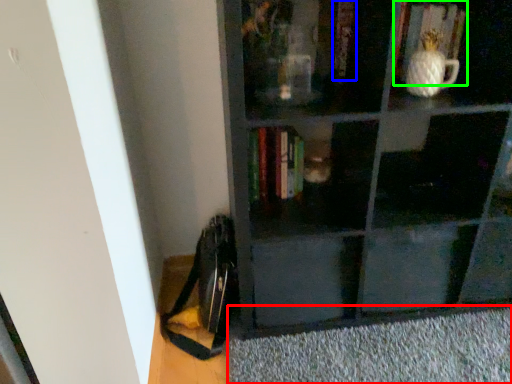
Question: Which is nearer to the doormat (highlighted by a red box)? book (highlighted by a blue box) or book (highlighted by a green box).

Choices:
 (A) book
 (B) book

Answer: (B)